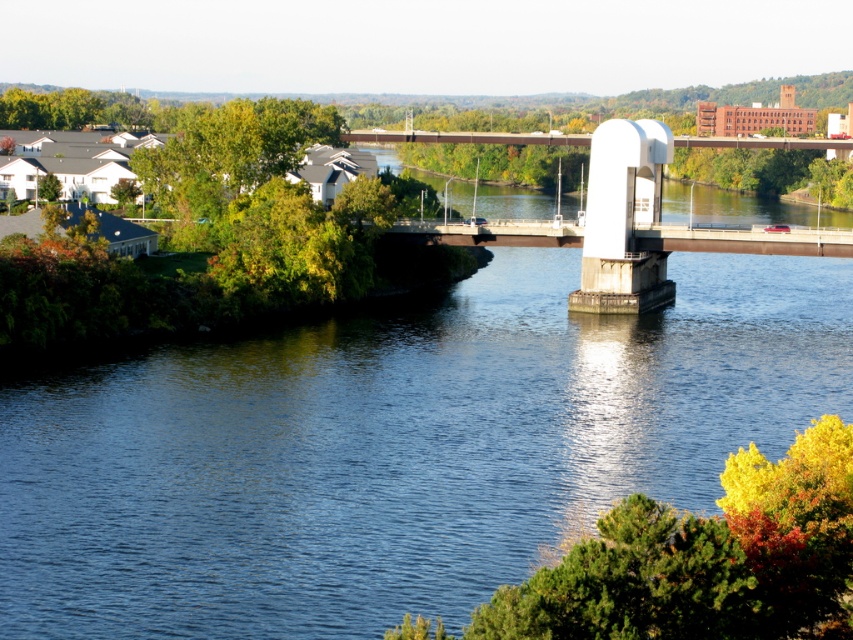
Is blue concrete river at center below white concrete pedestal at center?

Yes, blue concrete river at center is below white concrete pedestal at center.

What do you see at coordinates (396, 448) in the screenshot?
I see `blue concrete river at center` at bounding box center [396, 448].

Is point (766, 275) positioned behind point (675, 246)?

Yes, it is.

Image resolution: width=853 pixels, height=640 pixels. Identify the location of blue concrete river at center. (396, 448).